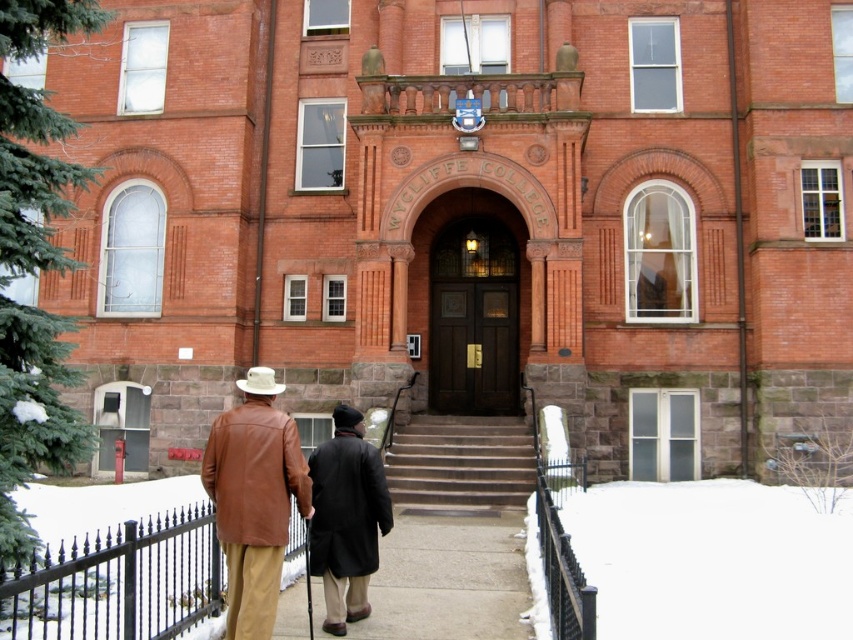
You are standing at the entrance of Wycliffe College and want to place your dark brown leather coat at center on the white powdery snow at lower center. Can you confirm if the snow is wide enough to accommodate the coat?

The white powdery snow at lower center might be wider than dark brown leather coat at center, so it is possible that the snow is wide enough to place the coat there.